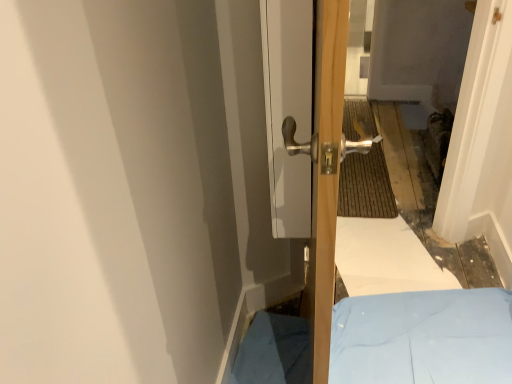
Describe the element at coordinates (325, 171) in the screenshot. I see `polished silver handle at center` at that location.

Locate an element on the screen. This screenshot has width=512, height=384. polished silver handle at center is located at coordinates (325, 171).

The height and width of the screenshot is (384, 512). I want to click on polished silver handle at center, so coord(325,171).